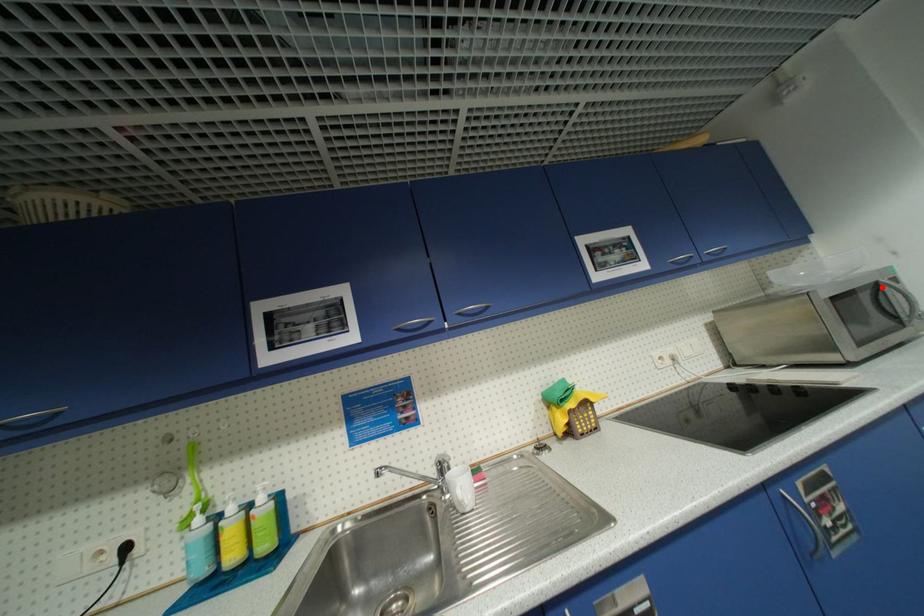
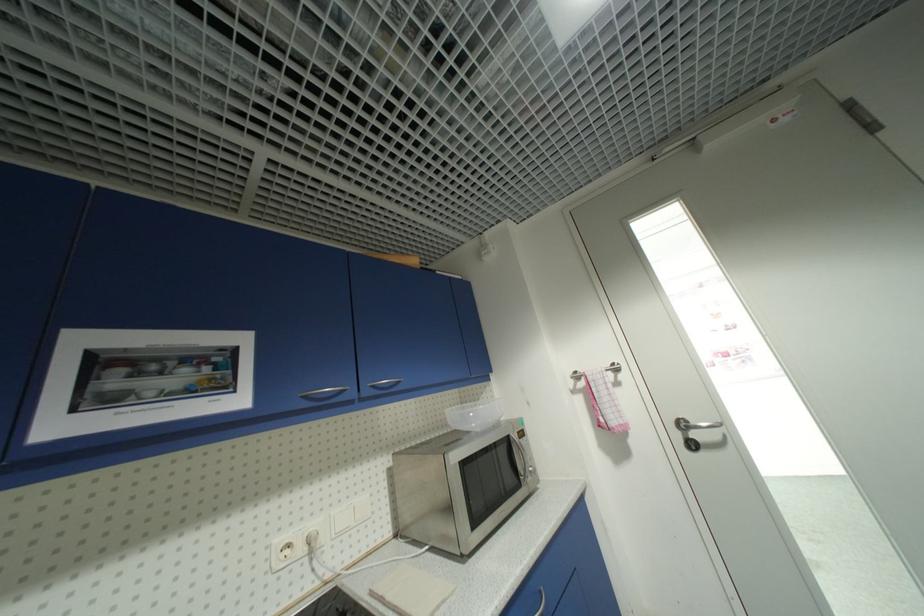
Question: I am providing you with two images of the same scene from different viewpoints. A red point is marked on the first image. At the location where the point appears in image 1, is it still visible in image 2?

Choices:
 (A) Yes
 (B) No

Answer: (A)